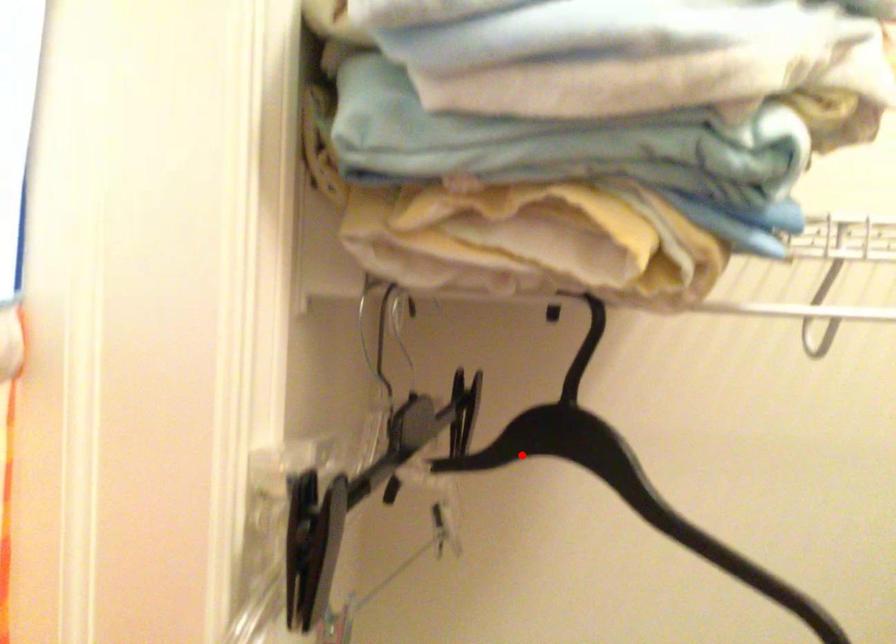
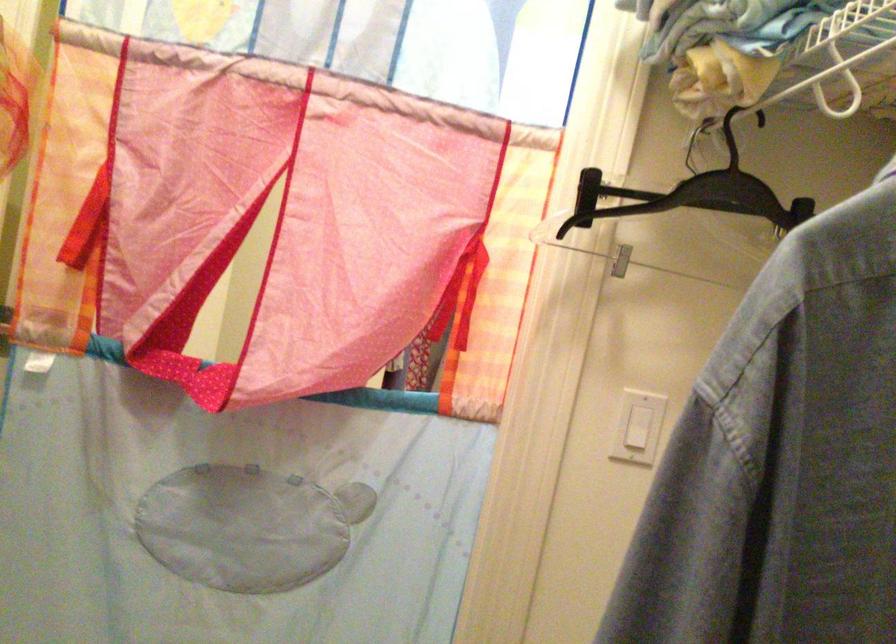
Question: I am providing you with two images of the same scene from different viewpoints. A red point is shown in image1. For the corresponding object point in image2, is it positioned nearer or farther from the camera?

Choices:
 (A) Nearer
 (B) Farther

Answer: (B)